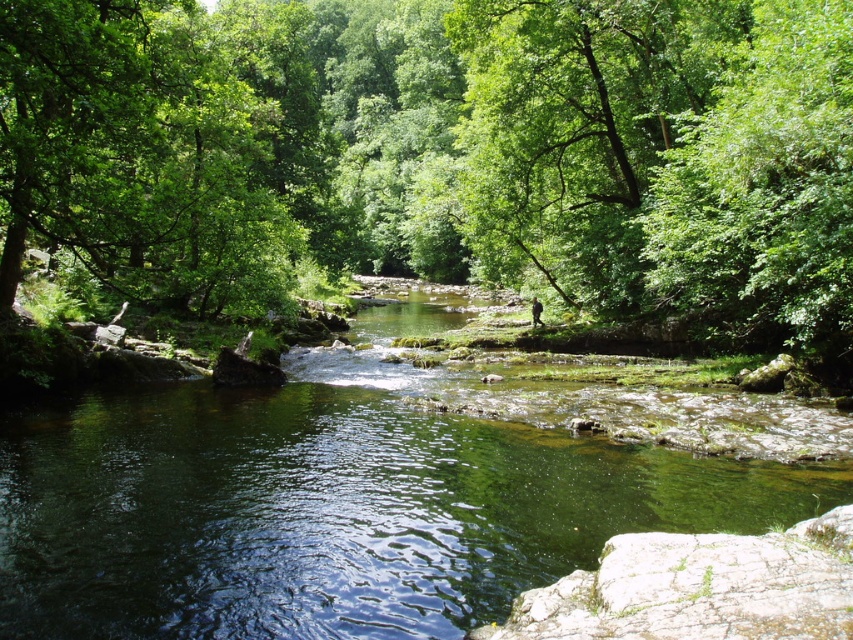
Is green leafy forest at center below green leafy tree at center?

No, green leafy forest at center is not below green leafy tree at center.

Is the position of green leafy forest at center more distant than that of green leafy tree at center?

No.

At what (x,y) coordinates should I click in order to perform the action: click on green leafy forest at center. Please return your answer as a coordinate pair (x, y). This screenshot has height=640, width=853. Looking at the image, I should click on (442, 148).

This screenshot has width=853, height=640. I want to click on green leafy forest at center, so click(x=442, y=148).

Does green leafy tree at center appear on the right side of green leafy tree at upper right?

In fact, green leafy tree at center is to the left of green leafy tree at upper right.

Is green leafy tree at center to the left of green leafy tree at upper right from the viewer's perspective?

Indeed, green leafy tree at center is positioned on the left side of green leafy tree at upper right.

Which is behind, point (595, 154) or point (741, 301)?

The point (595, 154) is behind.

You are a GUI agent. You are given a task and a screenshot of the screen. Output one action in this format:
    pyautogui.click(x=<x>, y=<y>)
    Task: Click on the green leafy tree at center
    This screenshot has width=853, height=640.
    Given the screenshot: What is the action you would take?
    pyautogui.click(x=577, y=129)

Between point (466, 428) and point (844, 292), which one is positioned behind?

Point (844, 292)

Does green smooth water at center have a smaller size compared to green leafy tree at upper right?

Correct, green smooth water at center occupies less space than green leafy tree at upper right.

What do you see at coordinates (331, 508) in the screenshot?
I see `green smooth water at center` at bounding box center [331, 508].

Locate an element on the screen. green smooth water at center is located at coordinates (331, 508).